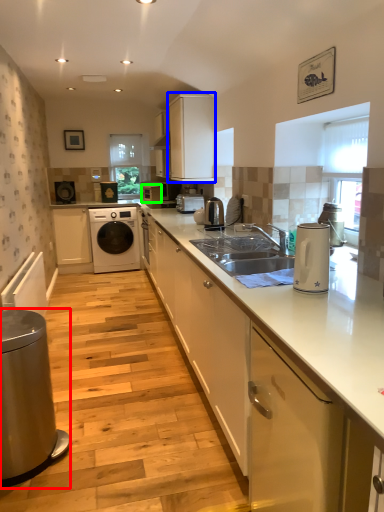
Question: Which object is the closest to the home appliance (highlighted by a red box)? Choose among these: cabinetry (highlighted by a blue box) or appliance (highlighted by a green box).

Choices:
 (A) cabinetry
 (B) appliance

Answer: (A)